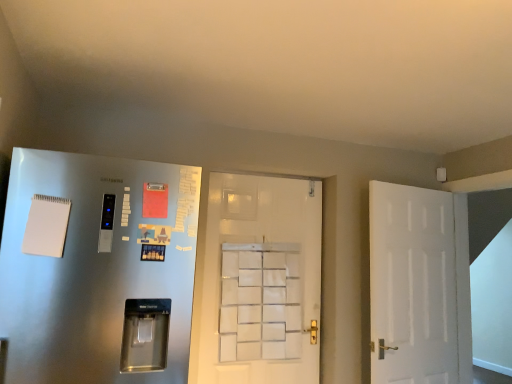
Question: Are satin silver refrigerator at left, which ranks as the third door in right-to-left order, and white matte door at center, which is counted as the 2th door, starting from the left, far apart?

Choices:
 (A) yes
 (B) no

Answer: (A)

Question: Is satin silver refrigerator at left, which ranks as the third door in right-to-left order, aimed at white matte door at center, which is counted as the 2th door, starting from the left?

Choices:
 (A) yes
 (B) no

Answer: (B)

Question: Considering the relative sizes of satin silver refrigerator at left, arranged as the first door when viewed from the left, and white matte door at center, which is counted as the 2th door, starting from the left, in the image provided, is satin silver refrigerator at left, arranged as the first door when viewed from the left, bigger than white matte door at center, which is counted as the 2th door, starting from the left,?

Choices:
 (A) yes
 (B) no

Answer: (A)

Question: Is satin silver refrigerator at left, which ranks as the third door in right-to-left order, taller than white matte door at center, which is counted as the 2th door, starting from the left?

Choices:
 (A) no
 (B) yes

Answer: (A)

Question: Considering the relative positions of satin silver refrigerator at left, arranged as the first door when viewed from the left, and white matte door at center, marked as the second door in a right-to-left arrangement, in the image provided, is satin silver refrigerator at left, arranged as the first door when viewed from the left, behind white matte door at center, marked as the second door in a right-to-left arrangement,?

Choices:
 (A) yes
 (B) no

Answer: (B)

Question: Can you see satin silver refrigerator at left, which ranks as the third door in right-to-left order, touching white matte door at center, which is counted as the 2th door, starting from the left?

Choices:
 (A) yes
 (B) no

Answer: (B)

Question: From the image's perspective, is white matte door at center, marked as the second door in a right-to-left arrangement, below satin silver refrigerator at left, which ranks as the third door in right-to-left order?

Choices:
 (A) yes
 (B) no

Answer: (A)

Question: Is white matte door at center, marked as the second door in a right-to-left arrangement, positioned with its back to satin silver refrigerator at left, arranged as the first door when viewed from the left?

Choices:
 (A) no
 (B) yes

Answer: (A)

Question: Considering the relative sizes of white matte door at center, which is counted as the 2th door, starting from the left, and satin silver refrigerator at left, arranged as the first door when viewed from the left, in the image provided, is white matte door at center, which is counted as the 2th door, starting from the left, wider than satin silver refrigerator at left, arranged as the first door when viewed from the left,?

Choices:
 (A) no
 (B) yes

Answer: (A)

Question: Would you say white matte door at center, which is counted as the 2th door, starting from the left, is a long distance from satin silver refrigerator at left, which ranks as the third door in right-to-left order?

Choices:
 (A) no
 (B) yes

Answer: (B)

Question: Considering the relative sizes of white matte door at center, marked as the second door in a right-to-left arrangement, and satin silver refrigerator at left, which ranks as the third door in right-to-left order, in the image provided, is white matte door at center, marked as the second door in a right-to-left arrangement, bigger than satin silver refrigerator at left, which ranks as the third door in right-to-left order,?

Choices:
 (A) yes
 (B) no

Answer: (B)

Question: Is white matte door at center, which is counted as the 2th door, starting from the left, further to the viewer compared to satin silver refrigerator at left, which ranks as the third door in right-to-left order?

Choices:
 (A) yes
 (B) no

Answer: (A)

Question: Is white matte door at center, which is counted as the 2th door, starting from the left, bigger than white matte door at right, marked as the 1th door in a right-to-left arrangement?

Choices:
 (A) no
 (B) yes

Answer: (A)